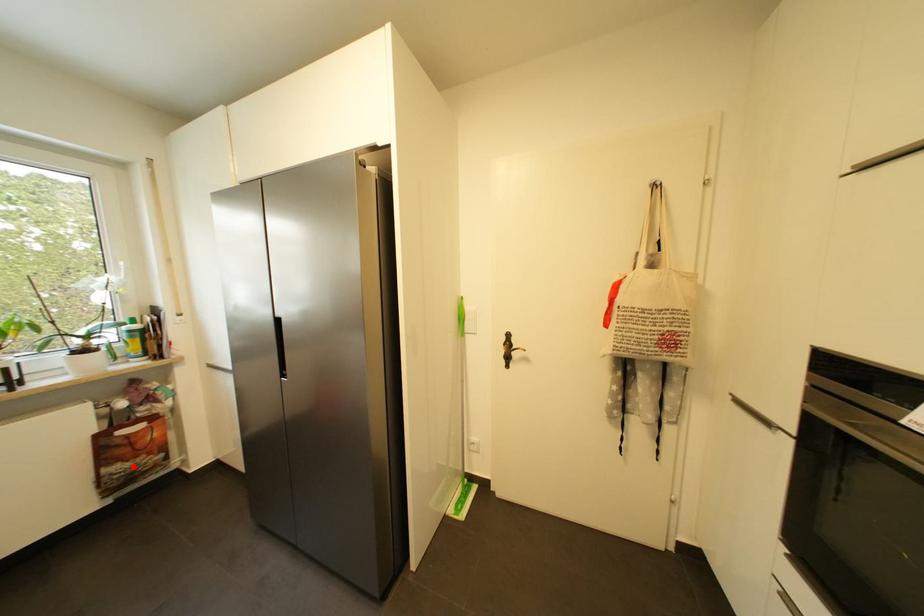
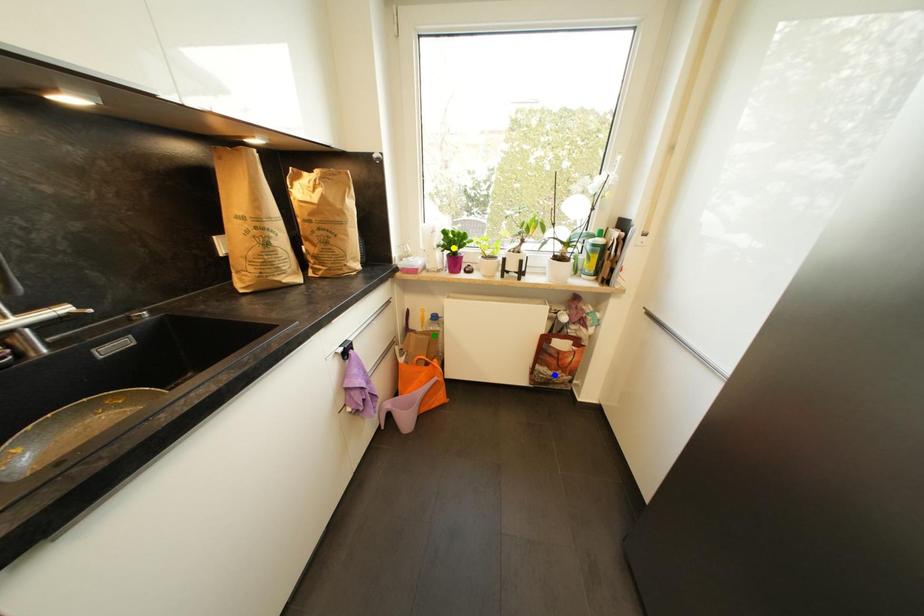
Question: I am providing you with two images of the same scene from different viewpoints. A red point is marked on the first image. You are given multiple points on the second image. Which point in image 2 is actually the same real-world point as the red point in image 1?

Choices:
 (A) green point
 (B) yellow point
 (C) blue point

Answer: (C)